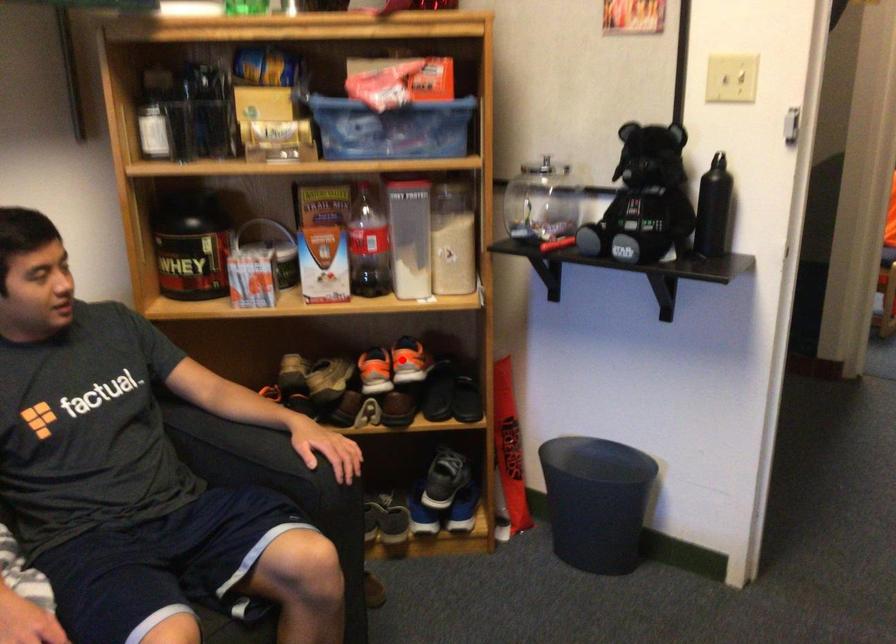
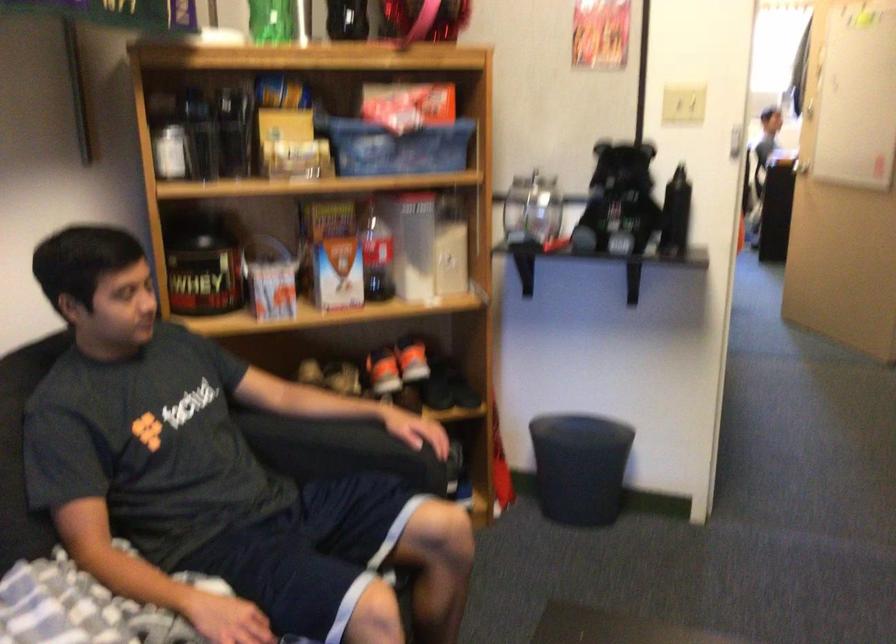
Question: I am providing you with two images of the same scene from different viewpoints. A red point is marked on the first image. Can you still see the location of the red point in image 2?

Choices:
 (A) Yes
 (B) No

Answer: (A)